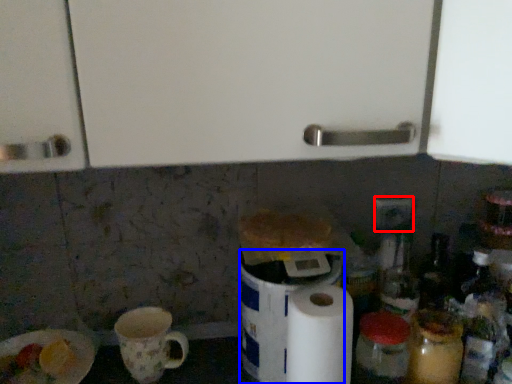
Question: Which of the following is the farthest to the observer, electric outlet (highlighted by a red box) or appliance (highlighted by a blue box)?

Choices:
 (A) electric outlet
 (B) appliance

Answer: (A)